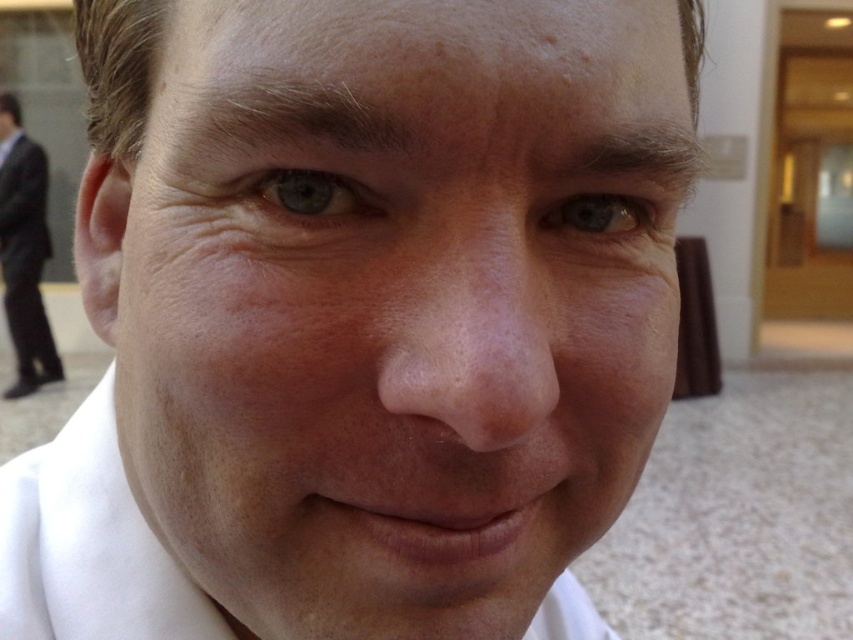
Between smooth skin face at center and brown matte eye at center, which one is positioned higher?

brown matte eye at center

Who is lower down, smooth skin face at center or brown matte eye at center?

smooth skin face at center

What do you see at coordinates (392, 301) in the screenshot? The image size is (853, 640). I see `smooth skin face at center` at bounding box center [392, 301].

Find the location of a particular element. smooth skin face at center is located at coordinates (392, 301).

Between point (13, 216) and point (631, 232), which one is positioned behind?

Point (13, 216)

Can you confirm if black suit at left is positioned to the left of brown matte eye at center?

Correct, you'll find black suit at left to the left of brown matte eye at center.

At what (x,y) coordinates should I click in order to perform the action: click on black suit at left. Please return your answer as a coordinate pair (x, y). The height and width of the screenshot is (640, 853). Looking at the image, I should click on (24, 252).

Who is positioned more to the right, smooth skin face at center or blue matte eye at upper left?

From the viewer's perspective, blue matte eye at upper left appears more on the right side.

Find the location of a particular element. smooth skin face at center is located at coordinates (392, 301).

Is point (248, 193) more distant than point (335, 214)?

Yes.

At what (x,y) coordinates should I click in order to perform the action: click on smooth skin face at center. Please return your answer as a coordinate pair (x, y). The height and width of the screenshot is (640, 853). Looking at the image, I should click on (392, 301).